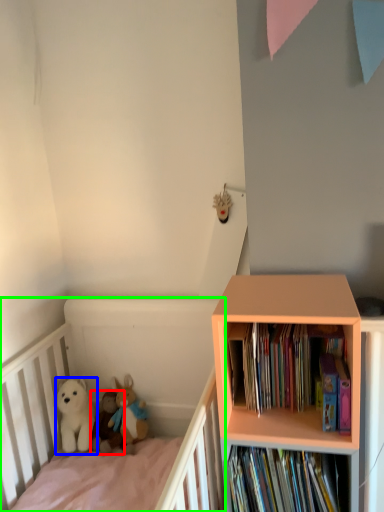
Question: Which object is the closest to the toy (highlighted by a red box)? Choose among these: dog (highlighted by a blue box) or infant bed (highlighted by a green box).

Choices:
 (A) dog
 (B) infant bed

Answer: (A)